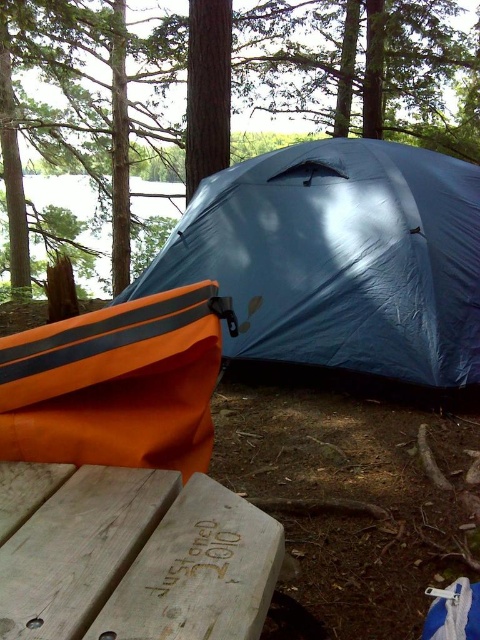
You are a camper who wants to take a photo of the wooden picnic table at center and the green matte tree at upper center. To ensure both are in focus, you need to know which is closer to you. Which object is nearer to your position?

The wooden picnic table at center is closer to the viewer than the green matte tree at upper center, so the picnic table is nearer to you.

You are planning to set up a campfire between the blue tarpaulin tent at center and the green matte tree at upper center. Given that the minimum safe distance for a campfire from any flammable object is 30 feet, is this location safe?

The blue tarpaulin tent at center and the green matte tree at upper center are 29.88 feet apart from each other. Since the campfire would be placed between them, it would be closer than the required 30 feet to at least one of the objects, making the location unsafe.